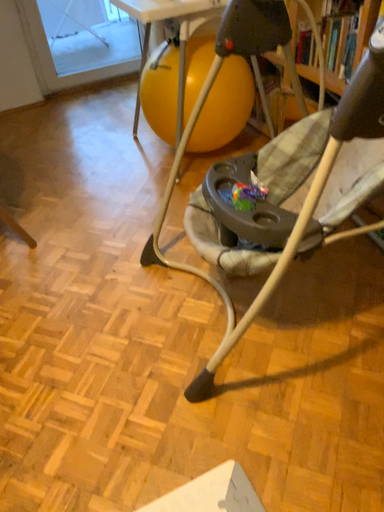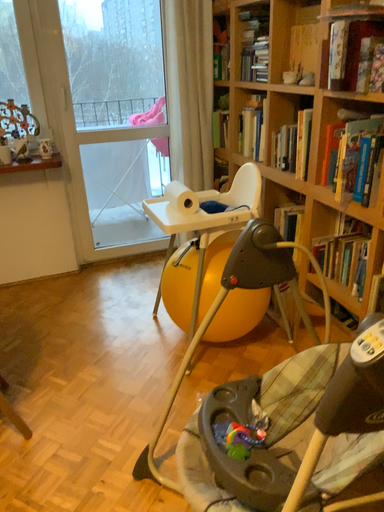
Question: Which way did the camera rotate in the video?

Choices:
 (A) rotated upward
 (B) rotated downward

Answer: (A)